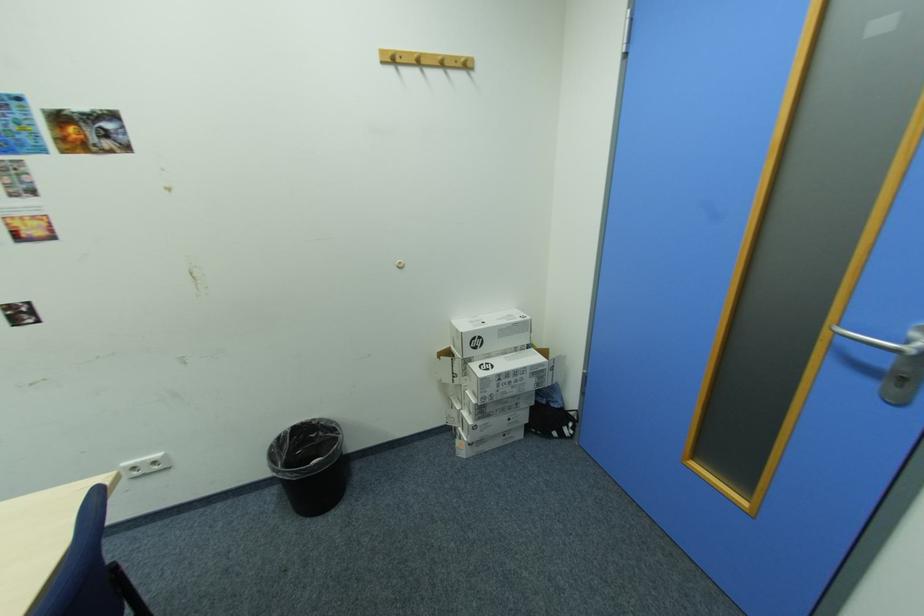
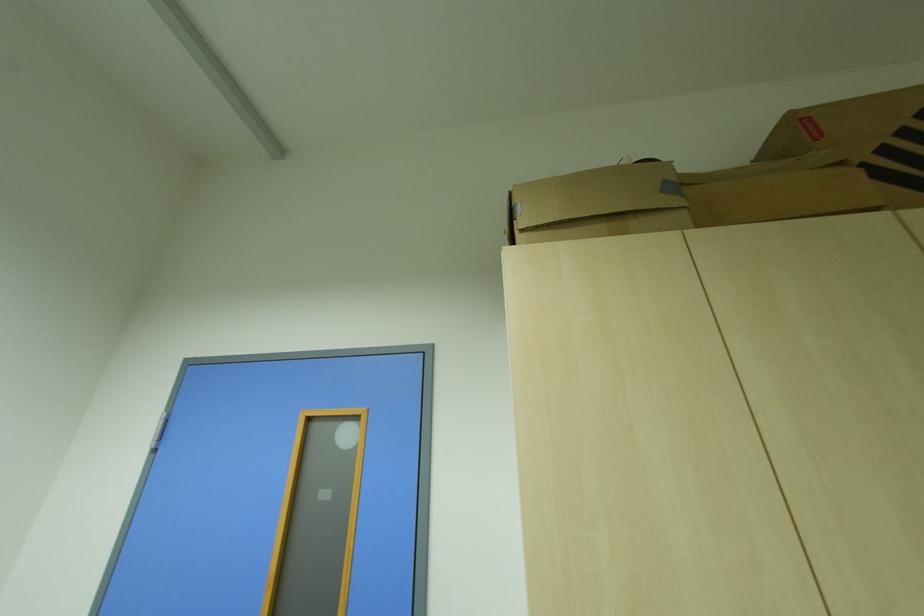
Based on the continuous images, in which direction is the camera rotating?

The camera's rotation is toward right-up.